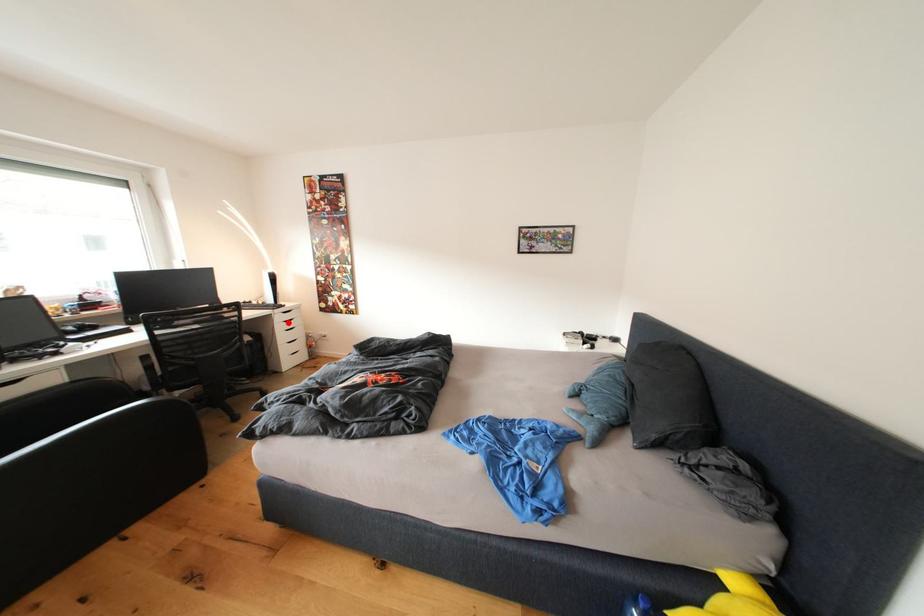
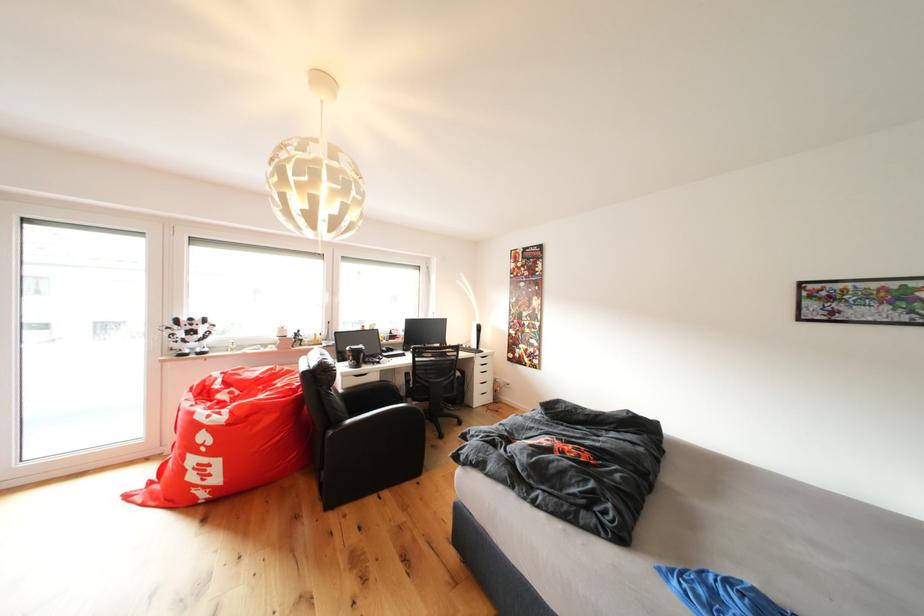
The point at the highlighted location is marked in the first image. Where is the corresponding point in the second image?

(487, 366)